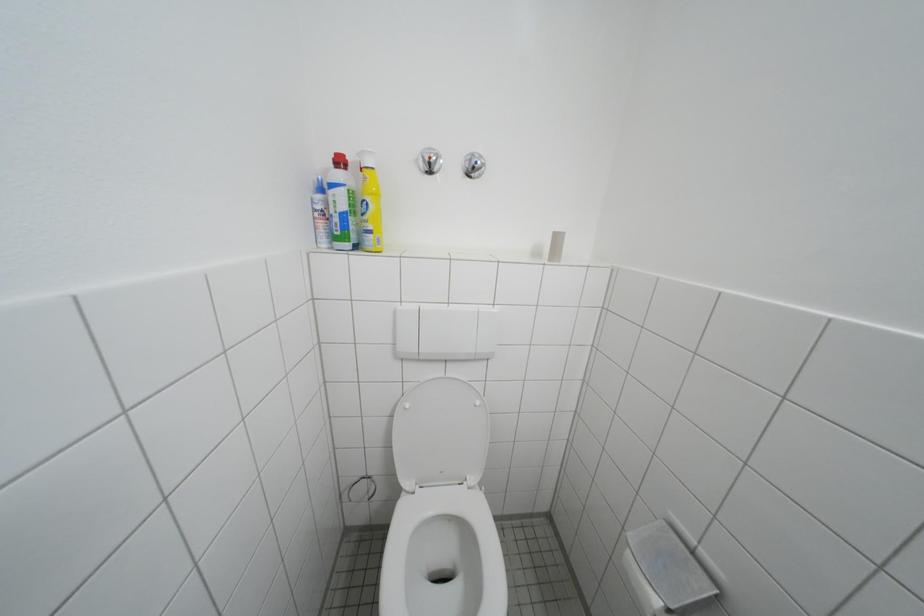
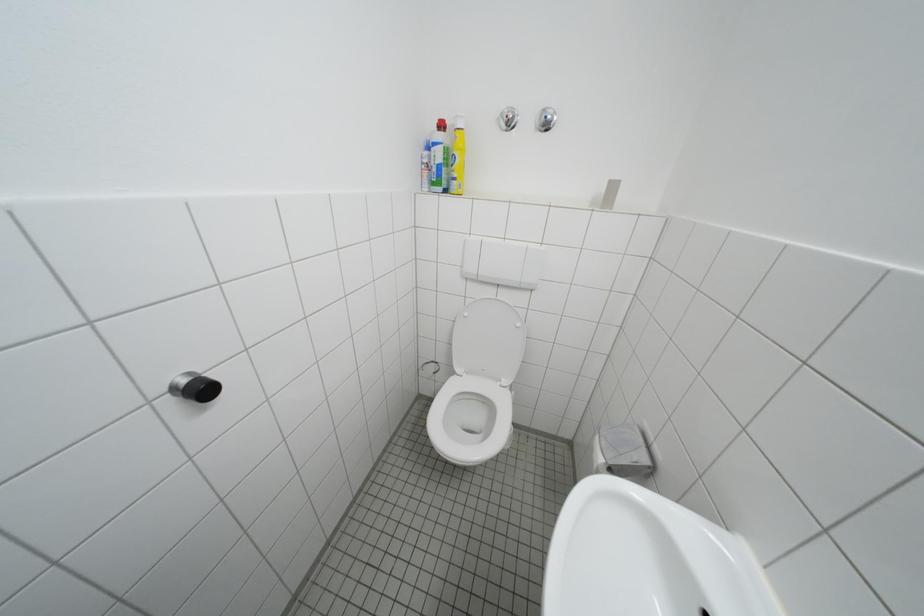
Question: The camera is either moving clockwise (left) or counter-clockwise (right) around the object. The first image is from the beginning of the video and the second image is from the end. Is the camera moving left or right when shooting the video?

Choices:
 (A) Left
 (B) Right

Answer: (B)